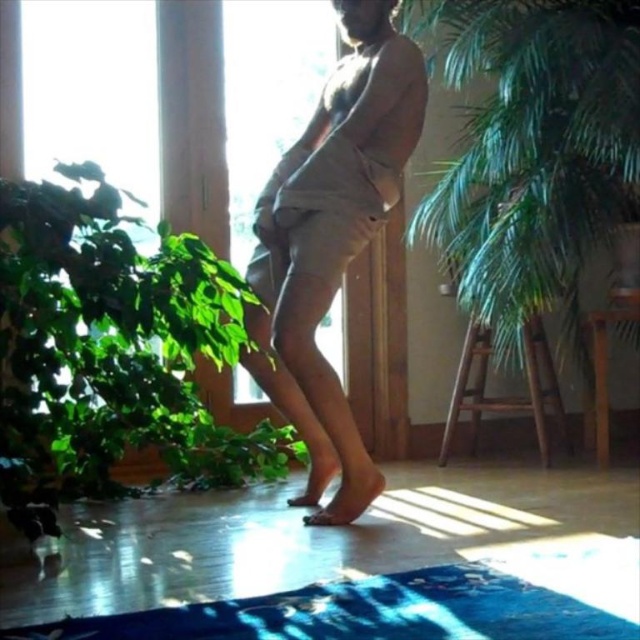
You are standing in the room and want to look outside through the transparent glass window at center. Which direction should you move relative to the wooden ladder at center?

You should move to the left of the wooden ladder at center to reach the transparent glass window at center, as the window is positioned to the left of the ladder.

You are a photographer setting up a shot in this room. You want to focus on the beige cotton shorts at center. The camera is currently positioned 1.5 meters away from the shorts. Should you move closer or farther away to achieve the desired focus?

The beige cotton shorts at center is 2.02 meters away from the camera. Since the camera is currently at 1.5 meters, you need to move it 0.52 meters farther away to match the required distance for focus.